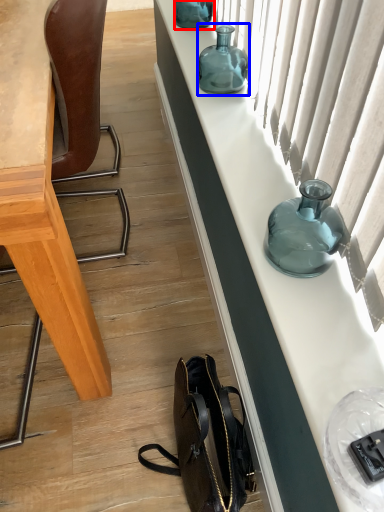
Question: Which point is closer to the camera, bottle (highlighted by a red box) or bottle (highlighted by a blue box)?

Choices:
 (A) bottle
 (B) bottle

Answer: (B)